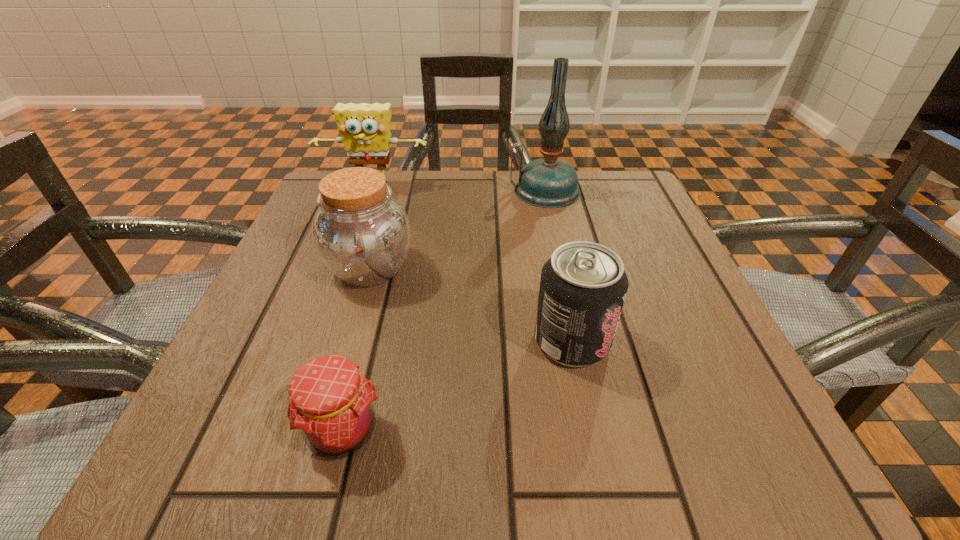
Where is `free space located 0.350m on the right of the jam`? free space located 0.350m on the right of the jam is located at coordinates (658, 430).

Find the location of `oil lamp situated at the far edge`. oil lamp situated at the far edge is located at coordinates (548, 182).

Locate an element on the screen. The height and width of the screenshot is (540, 960). sponge that is at the far edge is located at coordinates (365, 128).

Image resolution: width=960 pixels, height=540 pixels. Find the location of `object that is positioned at the near edge`. object that is positioned at the near edge is located at coordinates (331, 406).

This screenshot has width=960, height=540. I want to click on sponge that is at the left edge, so click(365, 128).

You are a GUI agent. You are given a task and a screenshot of the screen. Output one action in this format:
    pyautogui.click(x=<x>, y=<y>)
    Task: Click on the jar located at the left edge
    The width and height of the screenshot is (960, 540).
    Given the screenshot: What is the action you would take?
    pyautogui.click(x=361, y=233)

This screenshot has width=960, height=540. In order to click on jam present at the left edge in this screenshot , I will do `click(331, 406)`.

Locate an element on the screen. object that is at the right edge is located at coordinates (548, 182).

I want to click on object that is at the far left corner, so point(365,128).

At what (x,y) coordinates should I click in order to perform the action: click on object located at the near left corner. Please return your answer as a coordinate pair (x, y). This screenshot has width=960, height=540. Looking at the image, I should click on (331, 406).